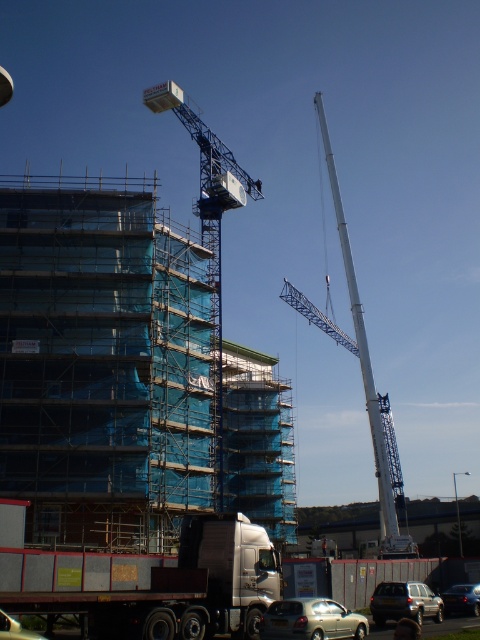
Consider the image. Does blue metallic crane at upper center have a greater width compared to metallic silver car at lower left?

Yes.

Between blue metallic crane at upper center and metallic silver car at lower left, which one appears on the right side from the viewer's perspective?

metallic silver car at lower left

Which is in front, point (154, 412) or point (3, 624)?

Point (3, 624) is in front.

At what (x,y) coordinates should I click in order to perform the action: click on blue metallic crane at upper center. Please return your answer as a coordinate pair (x, y). Looking at the image, I should click on (210, 243).

Is white metallic crane at center wider than shiny silver sedan at lower right?

Yes, white metallic crane at center is wider than shiny silver sedan at lower right.

Measure the distance between white metallic crane at center and camera.

A distance of 74.69 meters exists between white metallic crane at center and camera.

The image size is (480, 640). Identify the location of white metallic crane at center. (360, 364).

Locate an element on the screen. This screenshot has width=480, height=640. white metallic crane at center is located at coordinates coord(360,364).

The width and height of the screenshot is (480, 640). What do you see at coordinates (360, 364) in the screenshot?
I see `white metallic crane at center` at bounding box center [360, 364].

Between point (367, 355) and point (328, 614), which one is positioned in front?

Point (328, 614) is more forward.

This screenshot has width=480, height=640. Find the location of `white metallic crane at center`. white metallic crane at center is located at coordinates (360, 364).